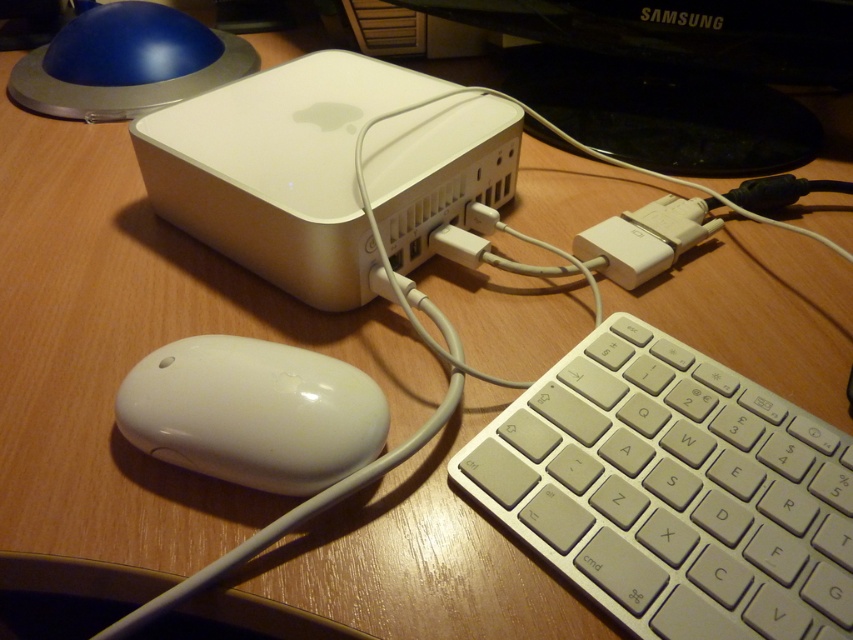
You are a technician who needs to replace the black glossy monitor at upper center. The replacement monitor is 24 inches wide. Can you determine if the desk has enough space to accommodate the new monitor without moving any existing peripherals?

The black glossy monitor at upper center is currently 22.81 inches from the viewer. The replacement monitor is 24 inches wide, which is slightly larger. However, the desk space availability isn not specified in the scene description. Therefore, it is uncertain if there is enough space to accommodate the new monitor without moving existing peripherals.

Looking at this image, you are organizing cables on a desk. You need to plug in a new cable into the back of the black glossy monitor at upper center and the white glossy mouse at lower left. Which device should you plug first based on their positions?

You should plug the cable into the white glossy mouse at lower left first because the black glossy monitor at upper center is further away from you, so the mouse is closer and easier to reach first.

You are setting up a new workspace and want to place a wireless charger between the white plastic keyboard at lower right and the black glossy monitor at upper center. Based on their positions, where should you place the wireless charger to ensure it is between both objects?

The wireless charger should be placed between the white plastic keyboard at lower right and the black glossy monitor at upper center. Since the white plastic keyboard at lower right is positioned under the black glossy monitor at upper center, the wireless charger should be placed in the middle area between them, ensuring it is above the keyboard and below the monitor.